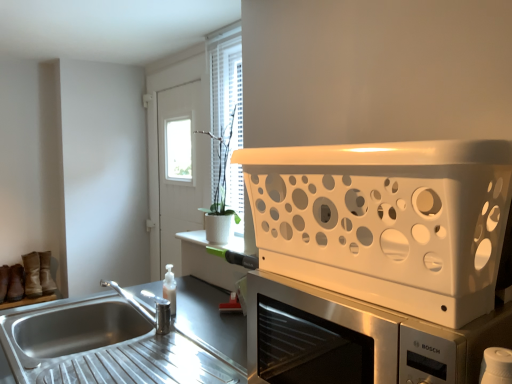
Question: From a real-world perspective, relative to stainless steel sink at lower left, is suede brown shoe at left, the 1th shoe in the right-to-left sequence, vertically above or below?

Choices:
 (A) below
 (B) above

Answer: (A)

Question: Would you say suede brown shoe at left, marked as the 3th shoe in a left-to-right arrangement, is to the left or to the right of stainless steel sink at lower left in the picture?

Choices:
 (A) right
 (B) left

Answer: (B)

Question: Based on their relative distances, which object is nearer to the leather boot at left?

Choices:
 (A) white matte microwave oven at upper right
 (B) brown suede boot at lower left, which appears as the 1th shoe when viewed from the left
 (C) suede brown shoe at left, the 1th shoe in the right-to-left sequence
 (D) stainless steel sink at lower left
 (E) white plastic basket at upper right

Answer: (C)

Question: Which object is the farthest from the white matte microwave oven at upper right?

Choices:
 (A) brown suede boot at lower left, the third shoe positioned from the right
 (B) stainless steel sink at lower left
 (C) leather boot at left
 (D) white glossy spray bottle at center
 (E) suede brown shoe at left, the 1th shoe in the right-to-left sequence

Answer: (A)